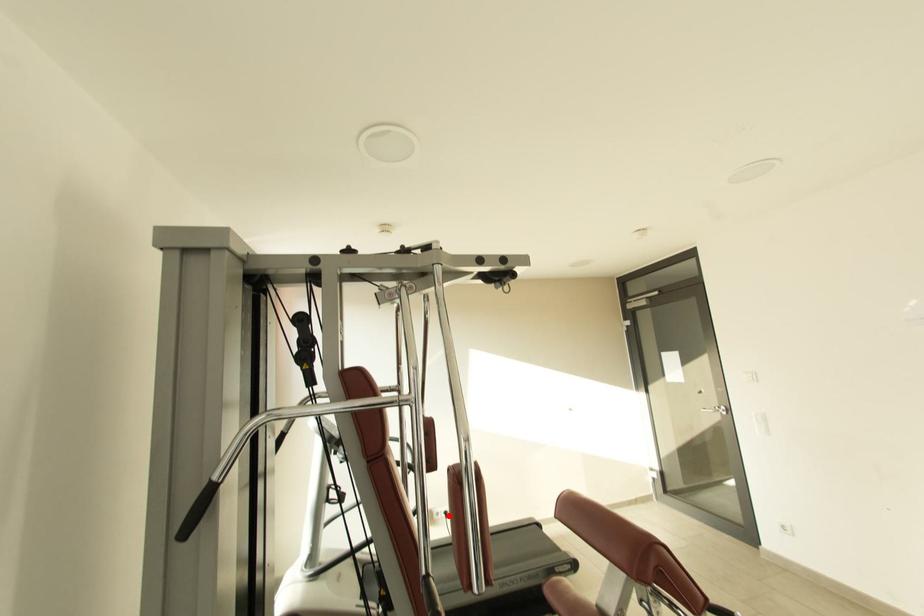
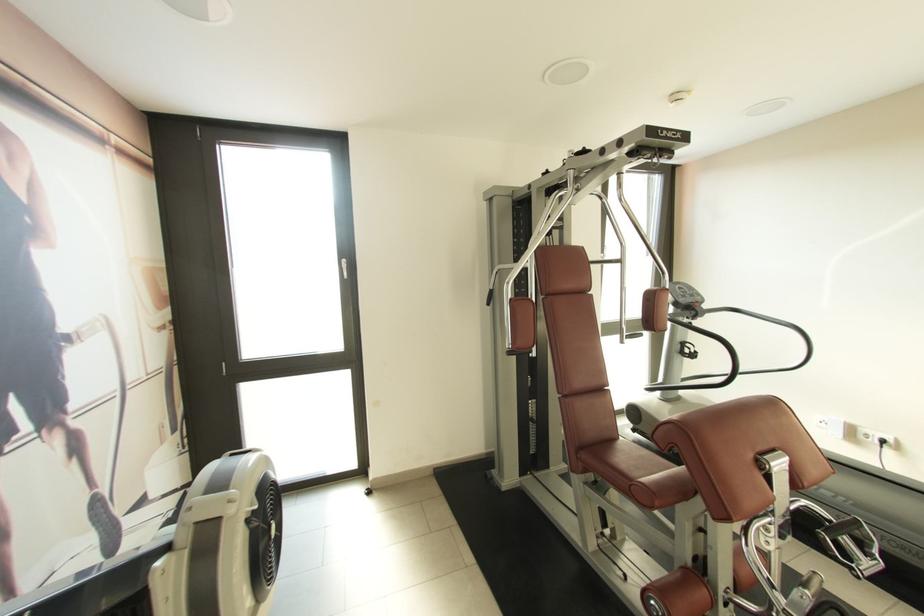
Question: A red point is marked in image1. In image2, is the corresponding 3D point closer to the camera or farther? Reply with the corresponding letter.

Choices:
 (A) The corresponding 3D point is closer.
 (B) The corresponding 3D point is farther.

Answer: (A)